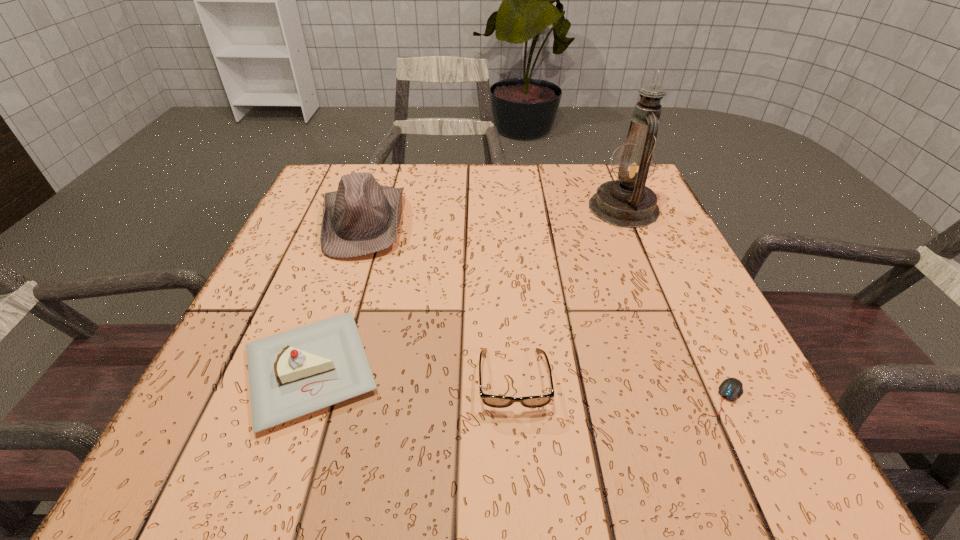
Where is `object present at the near left corner`? object present at the near left corner is located at coordinates (291, 374).

I want to click on object that is at the far right corner, so click(x=627, y=202).

The image size is (960, 540). What are the coordinates of `object that is at the near right corner` in the screenshot? It's located at (731, 388).

Image resolution: width=960 pixels, height=540 pixels. I want to click on vacant point at the far edge, so click(x=429, y=164).

I want to click on vacant space at the near edge, so click(505, 433).

Where is `free spot at the left edge of the desktop`? free spot at the left edge of the desktop is located at coordinates (312, 219).

What are the coordinates of `vacant space at the right edge` in the screenshot? It's located at (621, 271).

This screenshot has height=540, width=960. I want to click on vacant area that lies between the fedora and the third object from left to right, so click(x=438, y=301).

You are a GUI agent. You are given a task and a screenshot of the screen. Output one action in this format:
    pyautogui.click(x=<x>, y=<y>)
    Task: Click on the free space between the third shortest object and the oil lamp
    The width and height of the screenshot is (960, 540).
    Given the screenshot: What is the action you would take?
    pyautogui.click(x=468, y=289)

Where is `vacant space that's between the second tallest object and the tallest object`? The height and width of the screenshot is (540, 960). vacant space that's between the second tallest object and the tallest object is located at coordinates (493, 215).